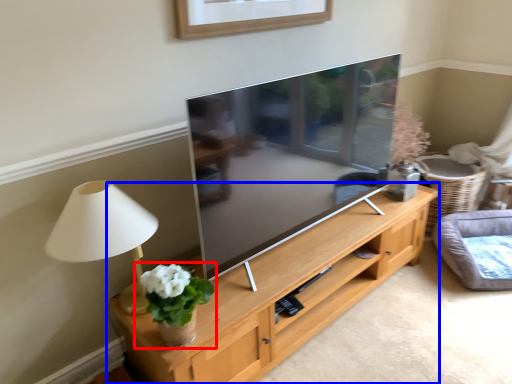
Question: Among these objects, which one is farthest to the camera, houseplant (highlighted by a red box) or shelf (highlighted by a blue box)?

Choices:
 (A) houseplant
 (B) shelf

Answer: (A)